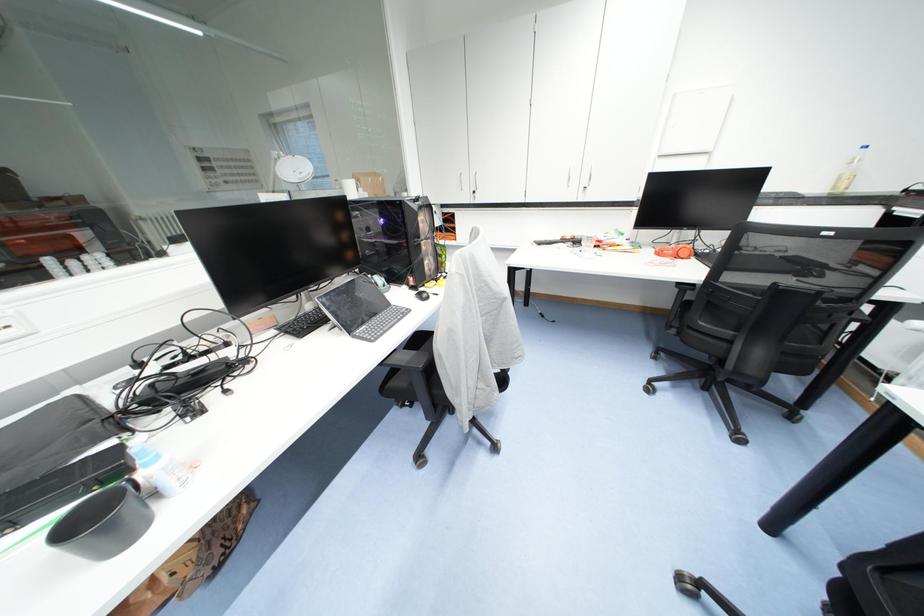
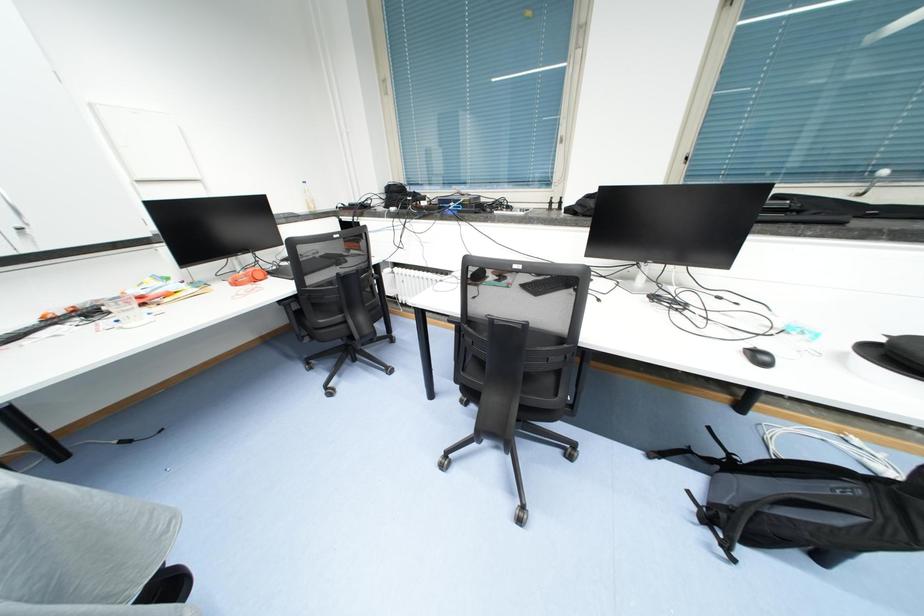
How did the camera likely rotate?

The rotation direction of the camera is right-down.